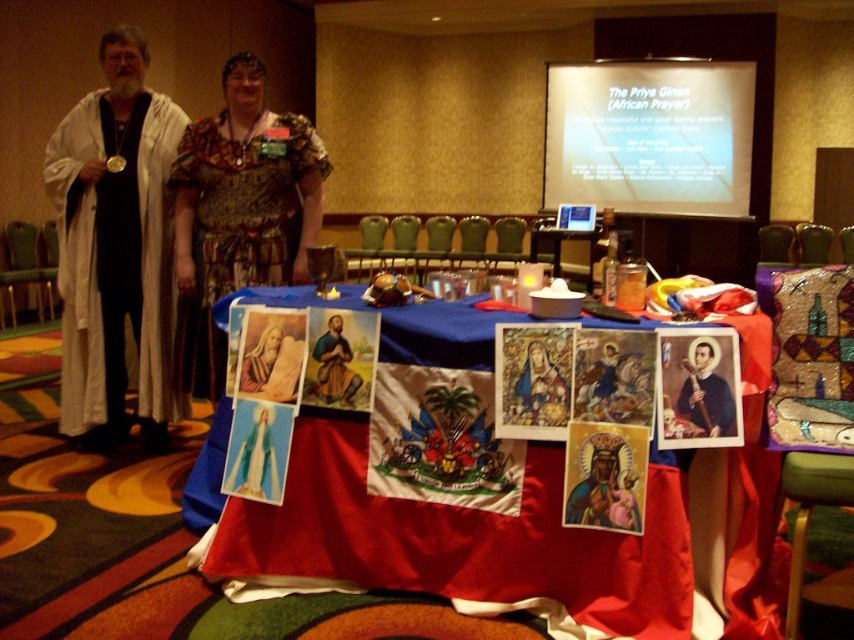
Can you confirm if matte paper picture at center is thinner than matte black saint at center?

Incorrect, matte paper picture at center's width is not less than matte black saint at center's.

What do you see at coordinates (256, 451) in the screenshot? I see `matte paper picture at center` at bounding box center [256, 451].

Where is `matte paper picture at center`? The height and width of the screenshot is (640, 854). matte paper picture at center is located at coordinates (256, 451).

Looking at this image, can you confirm if patterned fabric dress at center is taller than matte black saint at center?

Yes.

Does point (192, 196) lie in front of point (729, 417)?

No, it is not.

The height and width of the screenshot is (640, 854). What do you see at coordinates (238, 212) in the screenshot? I see `patterned fabric dress at center` at bounding box center [238, 212].

Where is `patterned fabric dress at center`? The image size is (854, 640). patterned fabric dress at center is located at coordinates (238, 212).

Is red satin tablecloth at center above white cloth at left?

No.

Is point (554, 573) less distant than point (73, 260)?

Yes, point (554, 573) is in front of point (73, 260).

In the scene shown: Who is more forward, (x=300, y=512) or (x=139, y=339)?

Point (x=300, y=512) is in front.

This screenshot has height=640, width=854. I want to click on red satin tablecloth at center, so 507,529.